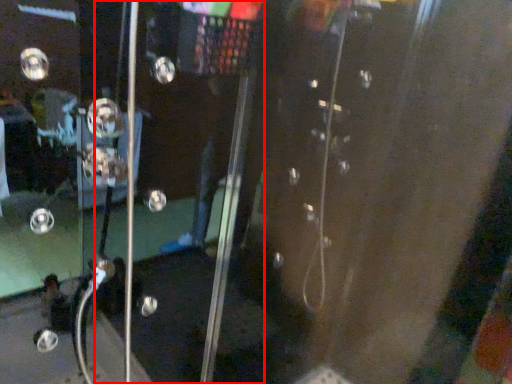
Question: From the image's perspective, considering the relative positions of screen door (annotated by the red box) and knob in the image provided, where is screen door (annotated by the red box) located with respect to the staircase?

Choices:
 (A) below
 (B) above

Answer: (A)